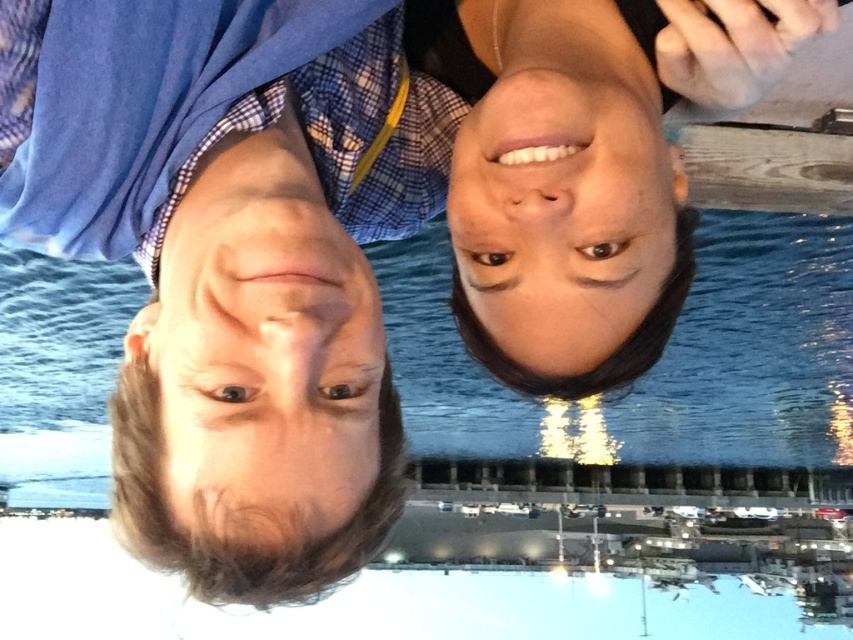
Question: Among these points, which one is nearest to the camera?

Choices:
 (A) (447, 378)
 (B) (167, 353)

Answer: (B)

Question: Is blue plaid shirt at left wider than blue water at center?

Choices:
 (A) no
 (B) yes

Answer: (A)

Question: Estimate the real-world distances between objects in this image. Which object is farther from the blue plaid shirt at left?

Choices:
 (A) blue water at center
 (B) smooth skin face at upper center

Answer: (A)

Question: Can you confirm if blue plaid shirt at left is positioned above smooth skin face at upper center?

Choices:
 (A) no
 (B) yes

Answer: (A)

Question: Estimate the real-world distances between objects in this image. Which object is closer to the blue water at center?

Choices:
 (A) smooth skin face at center
 (B) blue plaid shirt at left

Answer: (B)

Question: Can you confirm if blue plaid shirt at left is positioned above smooth skin face at upper center?

Choices:
 (A) yes
 (B) no

Answer: (B)